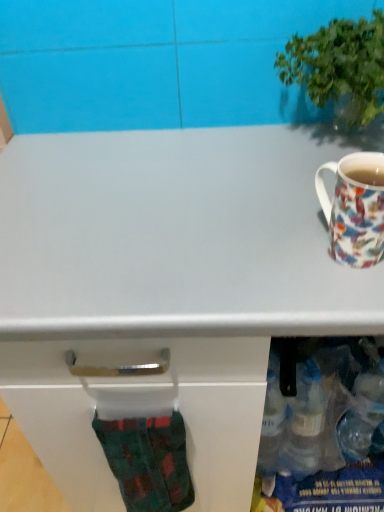
Question: Is porcelain floral mug at right not close to green leafy plant at upper right?

Choices:
 (A) yes
 (B) no

Answer: (B)

Question: Is porcelain floral mug at right to the right of green leafy plant at upper right from the viewer's perspective?

Choices:
 (A) yes
 (B) no

Answer: (B)

Question: From the image's perspective, is porcelain floral mug at right beneath green leafy plant at upper right?

Choices:
 (A) yes
 (B) no

Answer: (A)

Question: From a real-world perspective, is porcelain floral mug at right located beneath green leafy plant at upper right?

Choices:
 (A) no
 (B) yes

Answer: (B)

Question: Is porcelain floral mug at right closer to the viewer compared to green leafy plant at upper right?

Choices:
 (A) no
 (B) yes

Answer: (B)

Question: Considering the relative positions of porcelain floral mug at right and green leafy plant at upper right in the image provided, is porcelain floral mug at right behind green leafy plant at upper right?

Choices:
 (A) no
 (B) yes

Answer: (A)

Question: Is porcelain floral mug at right shorter than green plaid sock at lower left?

Choices:
 (A) yes
 (B) no

Answer: (A)

Question: From the image's perspective, is porcelain floral mug at right beneath green plaid sock at lower left?

Choices:
 (A) no
 (B) yes

Answer: (A)

Question: Is there a large distance between porcelain floral mug at right and green plaid sock at lower left?

Choices:
 (A) yes
 (B) no

Answer: (B)

Question: Can we say porcelain floral mug at right lies outside green plaid sock at lower left?

Choices:
 (A) no
 (B) yes

Answer: (B)

Question: Considering the relative sizes of porcelain floral mug at right and green plaid sock at lower left in the image provided, is porcelain floral mug at right taller than green plaid sock at lower left?

Choices:
 (A) no
 (B) yes

Answer: (A)

Question: Is green plaid sock at lower left surrounded by porcelain floral mug at right?

Choices:
 (A) yes
 (B) no

Answer: (B)

Question: Is green plaid sock at lower left further to the viewer compared to green leafy plant at upper right?

Choices:
 (A) yes
 (B) no

Answer: (A)